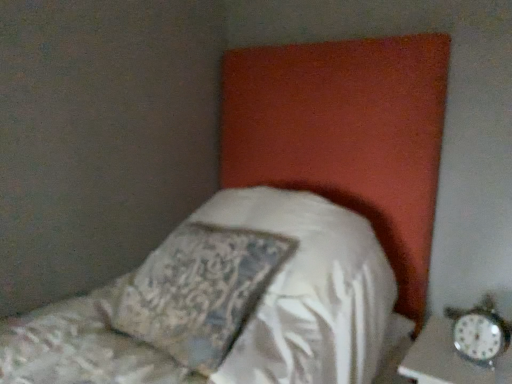
Question: Considering their positions, is metallic silver alarm clock at lower right located in front of or behind silky white pillow at center?

Choices:
 (A) front
 (B) behind

Answer: (B)

Question: Choose the correct answer: Is metallic silver alarm clock at lower right inside silky white pillow at center or outside it?

Choices:
 (A) inside
 (B) outside

Answer: (B)

Question: Is metallic silver alarm clock at lower right taller or shorter than silky white pillow at center?

Choices:
 (A) tall
 (B) short

Answer: (B)

Question: Considering the positions of silky white pillow at center and metallic silver alarm clock at lower right in the image, is silky white pillow at center taller or shorter than metallic silver alarm clock at lower right?

Choices:
 (A) tall
 (B) short

Answer: (A)

Question: Does point (245, 246) appear closer or farther from the camera than point (497, 332)?

Choices:
 (A) closer
 (B) farther

Answer: (B)

Question: Visually, is silky white pillow at center positioned to the left or to the right of metallic silver alarm clock at lower right?

Choices:
 (A) right
 (B) left

Answer: (B)

Question: From the image's perspective, is silky white pillow at center above or below metallic silver alarm clock at lower right?

Choices:
 (A) above
 (B) below

Answer: (A)